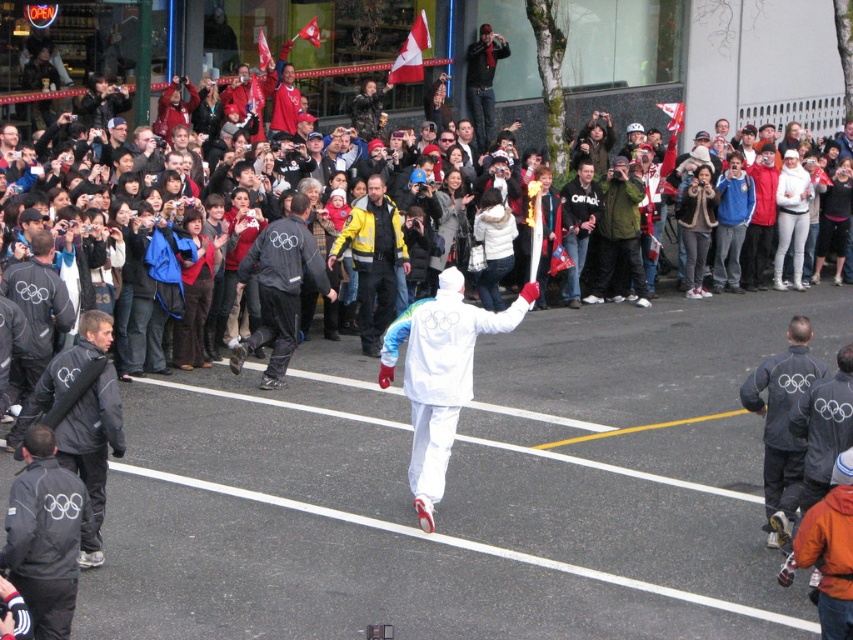
Which is behind, point (41, 442) or point (351, 216)?

The point (351, 216) is behind.

Measure the distance between black fabric jacket at lower left and camera.

21.43 feet

The image size is (853, 640). What do you see at coordinates (44, 534) in the screenshot?
I see `black fabric jacket at lower left` at bounding box center [44, 534].

Identify the location of black fabric jacket at lower left. (44, 534).

Can you confirm if black fabric jacket at center is taller than white cotton jacket at upper center?

In fact, black fabric jacket at center may be shorter than white cotton jacket at upper center.

Between black fabric jacket at center and white cotton jacket at upper center, which one is positioned lower?

Positioned lower is black fabric jacket at center.

Is point (306, 260) positioned before point (42, 99)?

Yes.

Where is `black fabric jacket at center`? The height and width of the screenshot is (640, 853). black fabric jacket at center is located at coordinates (279, 289).

Which of these two, black fabric jacket at lower left or black fabric jacket at left, stands shorter?

black fabric jacket at lower left is shorter.

Locate an element on the screen. The image size is (853, 640). black fabric jacket at lower left is located at coordinates (44, 534).